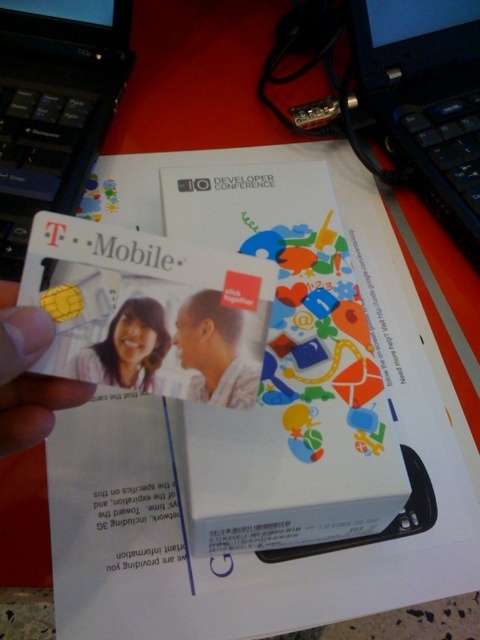
Question: Does black plastic laptop at upper left appear on the left side of matte plastic card at center?

Choices:
 (A) no
 (B) yes

Answer: (B)

Question: Which object is closer to the camera taking this photo?

Choices:
 (A) matte plastic card at center
 (B) black plastic laptop at upper left
 (C) matte plastic man at center

Answer: (A)

Question: Is the position of black plastic laptop at upper right less distant than that of yellow plastic card at center?

Choices:
 (A) no
 (B) yes

Answer: (A)

Question: Considering the real-world distances, which object is farthest from the black plastic laptop at upper right?

Choices:
 (A) yellow plastic card at center
 (B) matte plastic card at center

Answer: (A)

Question: Does yellow plastic card at center appear under matte plastic card at center?

Choices:
 (A) no
 (B) yes

Answer: (B)

Question: Estimate the real-world distances between objects in this image. Which object is farther from the matte plastic card at center?

Choices:
 (A) matte plastic man at center
 (B) yellow plastic card at center

Answer: (B)